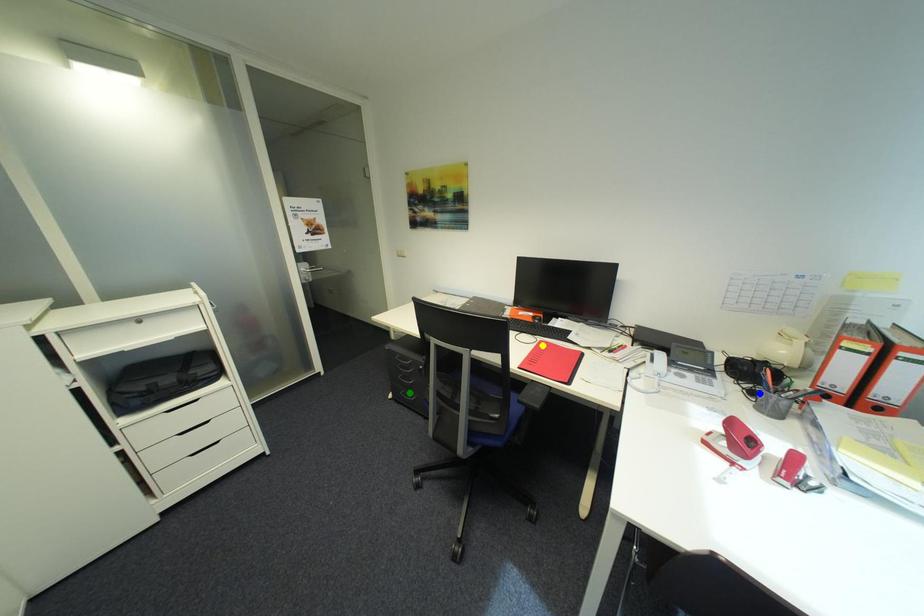
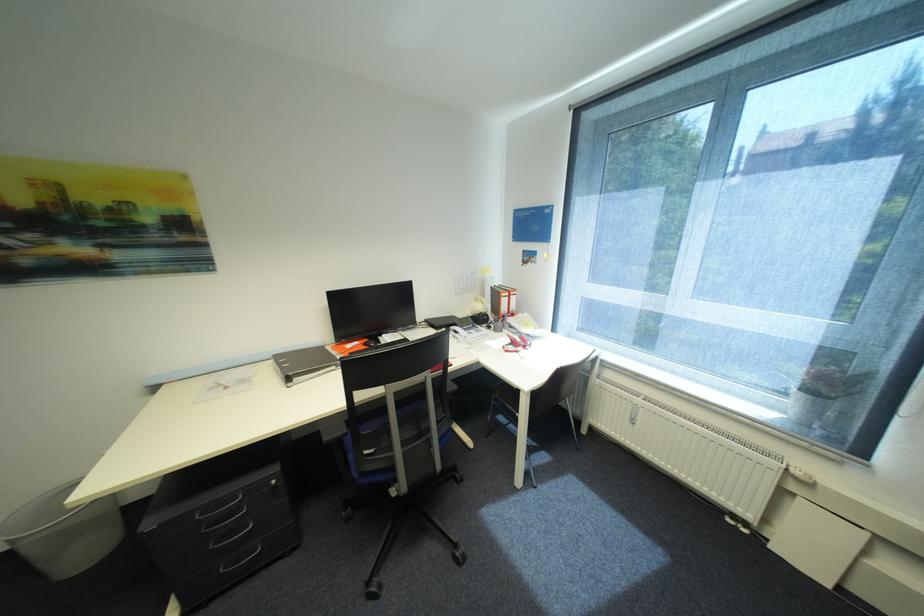
I am providing you with two images of the same scene from different viewpoints. Three points are marked in image1. Which point corresponds to a part or object that is occluded in image2?In image1, three points are marked. Which of them correspond to a part or object that is occluded in image2?Among the three points shown in image1, which one corresponds to a part or object that is no longer visible due to occlusion in image2?

yellow point cannot be seen in image2.